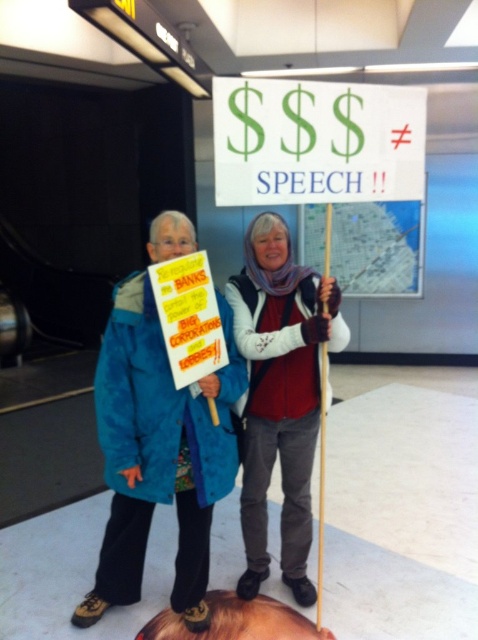
You are a photographer trying to capture a closeup of the blue fabric jacket at left and the matte white scarf at center. Which object requires a wider angle lens to capture fully in the frame?

The blue fabric jacket at left requires a wider angle lens because its width is larger than the matte white scarf at center.

You are a photographer trying to capture both the blue fabric jacket at left and the matte white scarf at center in a single frame. Based on their positions, which object is closer to the camera?

The blue fabric jacket at left is positioned under the matte white scarf at center, meaning it is closer to the camera since it appears below the scarf in the frame.